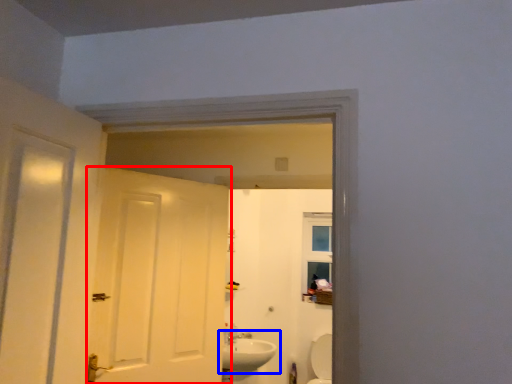
Question: Which object is closer to the camera taking this photo, door (highlighted by a red box) or sink (highlighted by a blue box)?

Choices:
 (A) door
 (B) sink

Answer: (A)